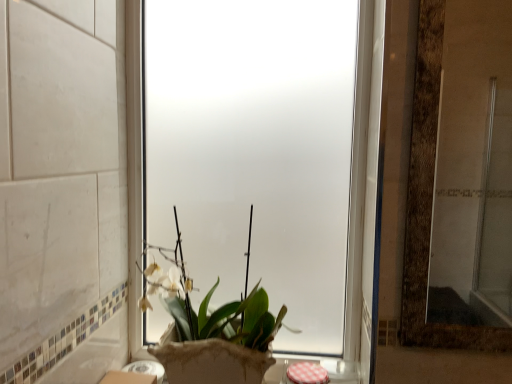
Locate an element on the screen. The width and height of the screenshot is (512, 384). frosted glass window at center is located at coordinates (362, 196).

What do you see at coordinates (362, 196) in the screenshot?
I see `frosted glass window at center` at bounding box center [362, 196].

What is the approximate width of frosted glass window at center?

frosted glass window at center is 2.15 inches wide.

You are a GUI agent. You are given a task and a screenshot of the screen. Output one action in this format:
    pyautogui.click(x=<x>, y=<y>)
    Task: Click on the green matte plant at center
    The height and width of the screenshot is (384, 512).
    Given the screenshot: What is the action you would take?
    pyautogui.click(x=214, y=324)

What do you see at coordinates (214, 324) in the screenshot? This screenshot has width=512, height=384. I see `green matte plant at center` at bounding box center [214, 324].

Measure the distance between point (176, 243) and camera.

The distance of point (176, 243) from camera is 35.31 inches.

The image size is (512, 384). I want to click on frosted glass window at center, so click(362, 196).

In the image, is green matte plant at center on the left side or the right side of frosted glass window at center?

From the image, it's evident that green matte plant at center is to the left of frosted glass window at center.

Considering the relative positions of green matte plant at center and frosted glass window at center in the image provided, is green matte plant at center in front of frosted glass window at center?

Yes, it is.

Which is in front, point (259, 333) or point (378, 120)?

The point (378, 120) is more forward.

From the image's perspective, would you say green matte plant at center is positioned over frosted glass window at center?

No, from the image's perspective, green matte plant at center is not above frosted glass window at center.

From a real-world perspective, which object rests below the other?

green matte plant at center.

Is green matte plant at center thinner than frosted glass window at center?

No.

Who is shorter, green matte plant at center or frosted glass window at center?

Standing shorter between the two is green matte plant at center.

Between green matte plant at center and frosted glass window at center, which one has smaller size?

frosted glass window at center.

Is green matte plant at center situated inside frosted glass window at center or outside?

The correct answer is: outside.

Are green matte plant at center and frosted glass window at center far apart?

Actually, green matte plant at center and frosted glass window at center are a little close together.

Is green matte plant at center oriented towards frosted glass window at center?

No, green matte plant at center is not aimed at frosted glass window at center.

Can you tell me how much green matte plant at center and frosted glass window at center differ in facing direction?

The angular difference between green matte plant at center and frosted glass window at center is 0.112 degrees.

At what (x,y) coordinates should I click in order to perform the action: click on window to the right of green matte plant at center. Please return your answer as a coordinate pair (x, y). Looking at the image, I should click on (362, 196).

Consider the image. Does frosted glass window at center appear on the right side of green matte plant at center?

Correct, you'll find frosted glass window at center to the right of green matte plant at center.

Considering the relative positions of frosted glass window at center and green matte plant at center in the image provided, is frosted glass window at center behind green matte plant at center?

Yes, the depth of frosted glass window at center is greater than that of green matte plant at center.

Is point (360, 223) farther from camera compared to point (251, 382)?

That is True.

From the image's perspective, is frosted glass window at center positioned above or below green matte plant at center?

frosted glass window at center is situated higher than green matte plant at center in the image.

From a real-world perspective, is frosted glass window at center over green matte plant at center?

Correct, in the physical world, frosted glass window at center is higher than green matte plant at center.

Between frosted glass window at center and green matte plant at center, which one has smaller width?

With smaller width is frosted glass window at center.

Considering the sizes of frosted glass window at center and green matte plant at center in the image, is frosted glass window at center taller or shorter than green matte plant at center?

In the image, frosted glass window at center appears to be taller than green matte plant at center.

Between frosted glass window at center and green matte plant at center, which one has smaller size?

Smaller between the two is frosted glass window at center.

Is frosted glass window at center not within green matte plant at center?

Yes, frosted glass window at center is outside of green matte plant at center.

In the scene shown: Is frosted glass window at center not near green matte plant at center?

No, there isn't a large distance between frosted glass window at center and green matte plant at center.

Looking at this image, could you tell me if frosted glass window at center is turned towards green matte plant at center?

Yes, frosted glass window at center is oriented towards green matte plant at center.

Can you tell me how much frosted glass window at center and green matte plant at center differ in facing direction?

frosted glass window at center and green matte plant at center are facing 0.112 degrees away from each other.

This screenshot has width=512, height=384. In the image, there is a frosted glass window at center. What are the coordinates of `houseplant below it (from a real-world perspective)` in the screenshot? It's located at (214, 324).

Find the location of a particular element. The width and height of the screenshot is (512, 384). window above the green matte plant at center (from a real-world perspective) is located at coordinates (362, 196).

Where is `houseplant on the left of frosted glass window at center`? This screenshot has width=512, height=384. houseplant on the left of frosted glass window at center is located at coordinates (214, 324).